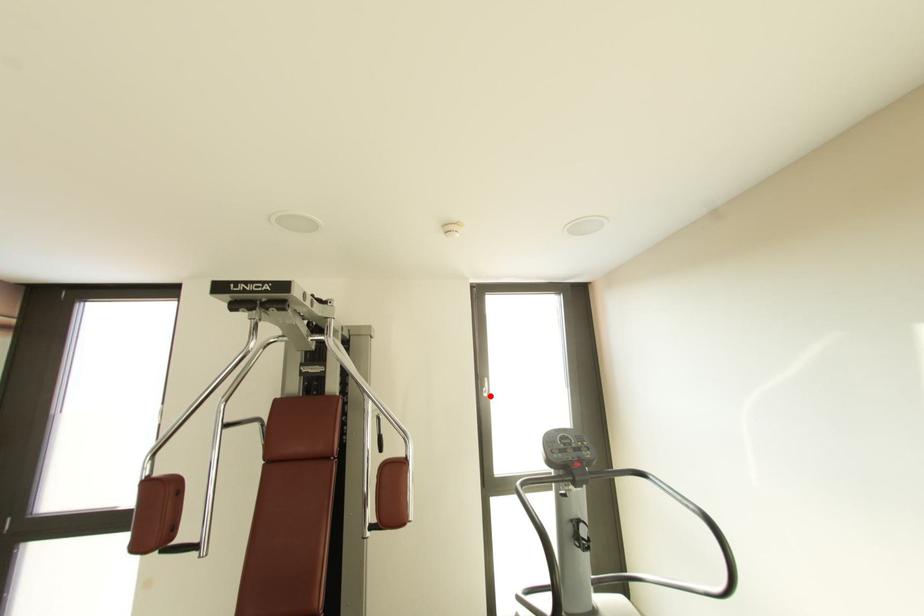
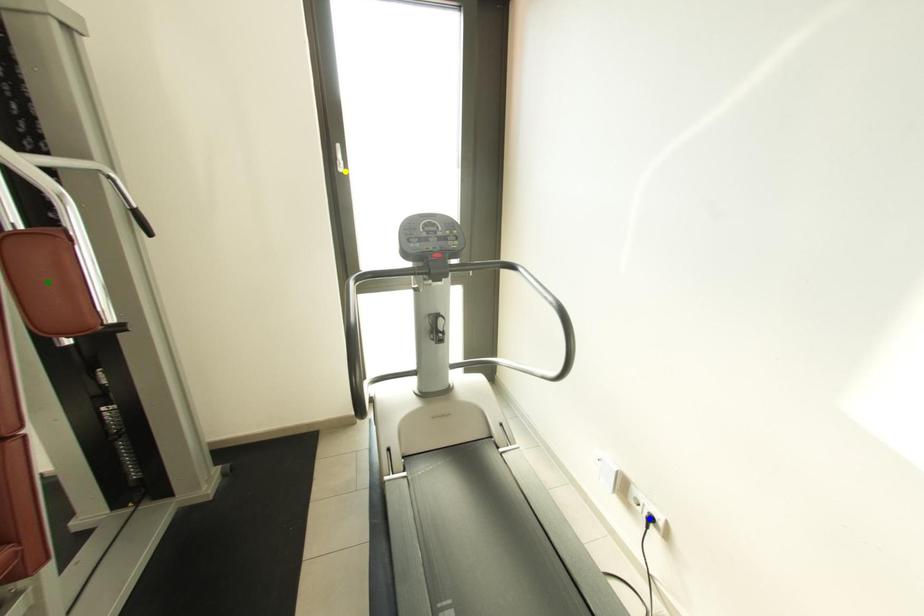
Question: I am providing you with two images of the same scene from different viewpoints. A red point is marked on the first image. You are given multiple points on the second image. Which mark in image 2 goes with the point in image 1?

Choices:
 (A) green point
 (B) blue point
 (C) yellow point

Answer: (C)